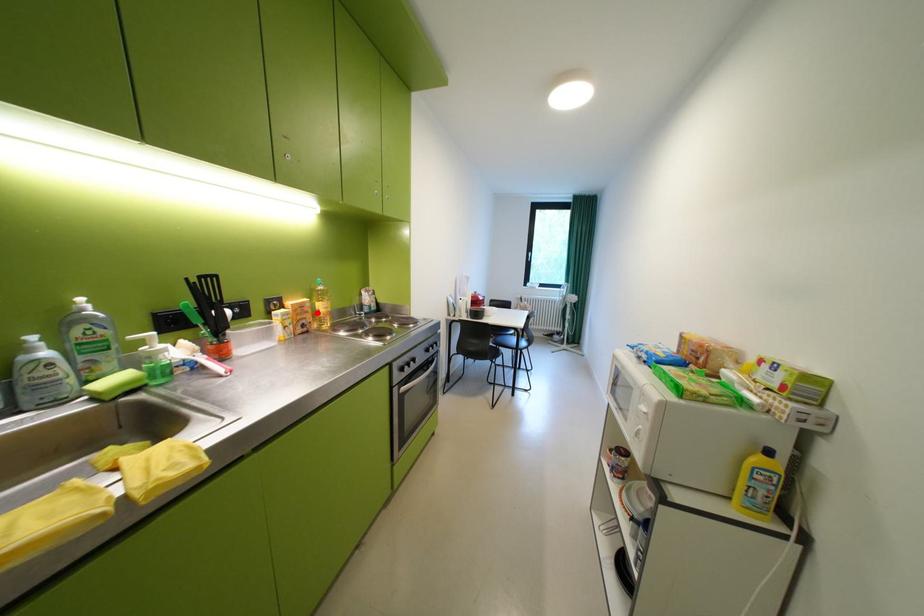
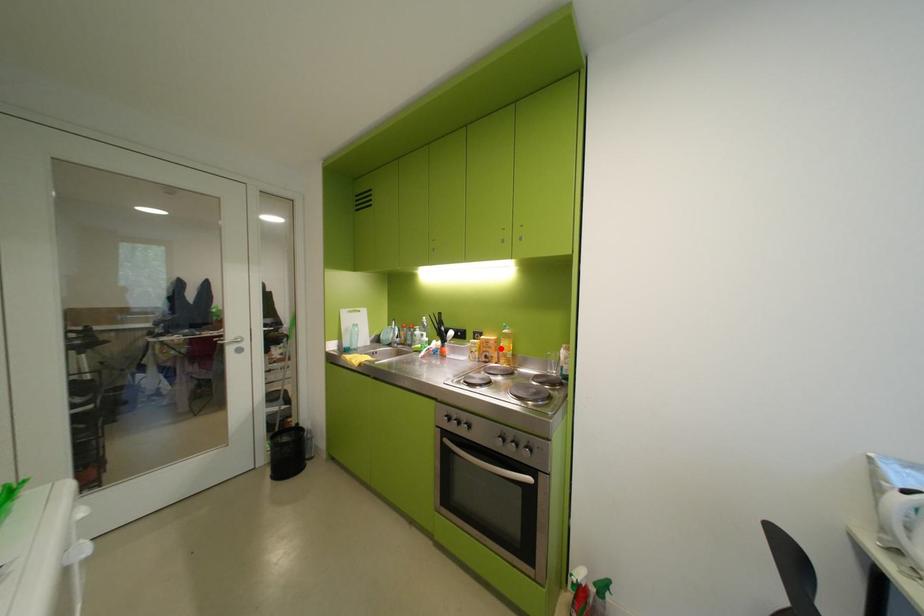
I am providing you with two images of the same scene from different viewpoints. A red point is marked on the first image and another point is marked on the second image. Are the points marked in image1 and image2 representing the same 3D position?

Yes